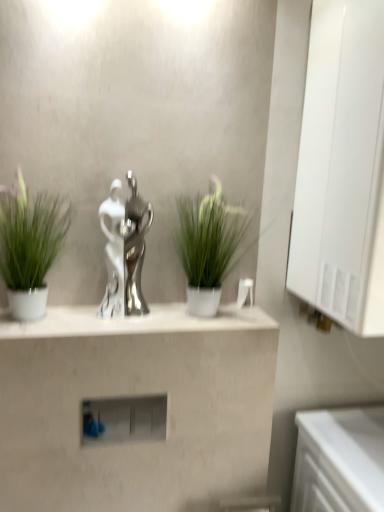
Identify the location of spots to the right of silver metallic trophy at center. The image size is (384, 512). (167, 316).